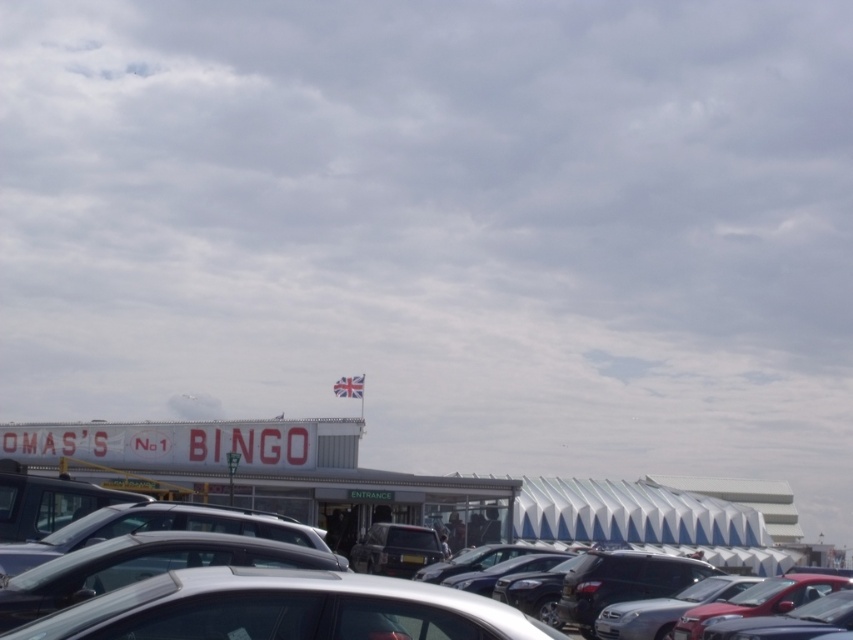
You are a parking attendant at OMASSS No 1 BINGO and need to park two cars in a tight space. The silver metallic car at center and the satin silver car at center must be parked side by side. Which car should you park closer to the entrance to ensure both fit without overlapping?

The satin silver car at center should be parked closer to the entrance because it is shorter than the silver metallic car at center, allowing both to fit side by side in the tight space.

Looking at this image, you are a visitor arriving at OMASSS No 1 BINGO and need to park your car. You see a silver metallic car at lower center and a shiny red car at lower right. Which car is shorter in height?

The silver metallic car at lower center has a lesser height compared to the shiny red car at lower right, so the silver metallic car at lower center is shorter.

You are driving a car and want to park in the Bingo hall parking lot. The parking spot you want is between the silver metallic car at center and the satin silver car at center. The parking spot is 2 meters wide. Do you think your car will fit in the parking spot between them?

The silver metallic car at center might be wider than satin silver car at center, so the available space between them could be narrower than 2 meters. Therefore, your car may not fit in the parking spot between them.